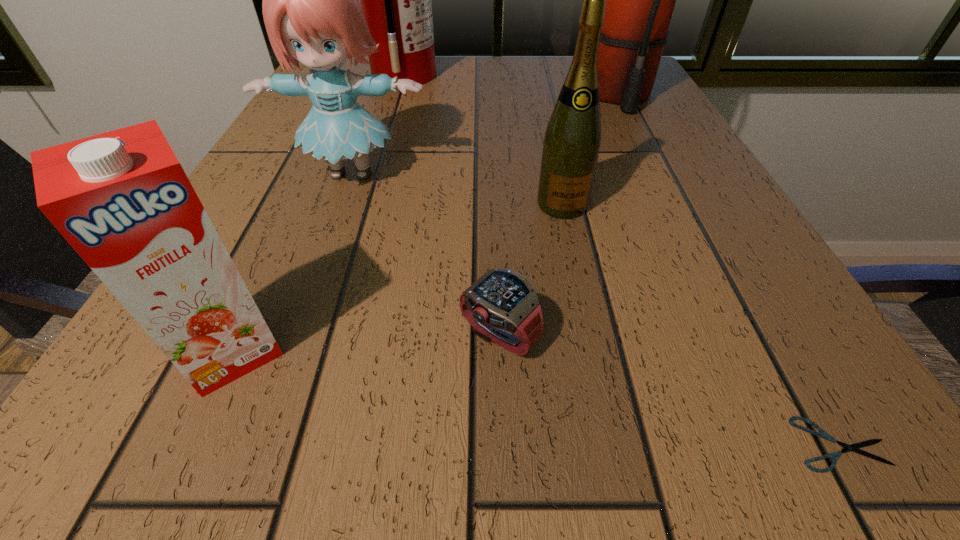
I want to click on free space that satisfies the following two spatial constraints: 1. on the front-facing side of the doll; 2. on the right side of the shears, so click(253, 444).

Identify the location of blank space that satisfies the following two spatial constraints: 1. on the front side of the watch; 2. on the right side of the shortest object. (503, 444).

Identify the location of free location that satisfies the following two spatial constraints: 1. on the nozzle of the shears; 2. on the left side of the right fire extinguisher. The height and width of the screenshot is (540, 960). (794, 444).